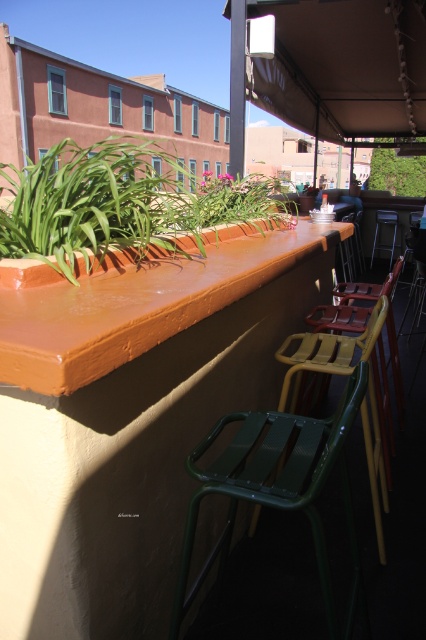
Question: Considering the real-world distances, which object is closest to the brown fabric canopy at upper center?

Choices:
 (A) metallic green chair at center
 (B) matte green plastic chair at center

Answer: (A)

Question: Which of the following is the closest to the observer?

Choices:
 (A) coord(353,298)
 (B) coord(383,502)

Answer: (B)

Question: Is green plastic chair at center below matte green plastic chair at center?

Choices:
 (A) yes
 (B) no

Answer: (A)

Question: Is matte green plastic chair at center thinner than metallic green chair at center?

Choices:
 (A) no
 (B) yes

Answer: (A)

Question: Which point is closer to the camera taking this photo?

Choices:
 (A) (385, 289)
 (B) (360, 241)
 (C) (385, 170)
 (D) (344, 339)

Answer: (D)

Question: Is brown fabric canopy at upper center bigger than green metal chair at center?

Choices:
 (A) no
 (B) yes

Answer: (B)